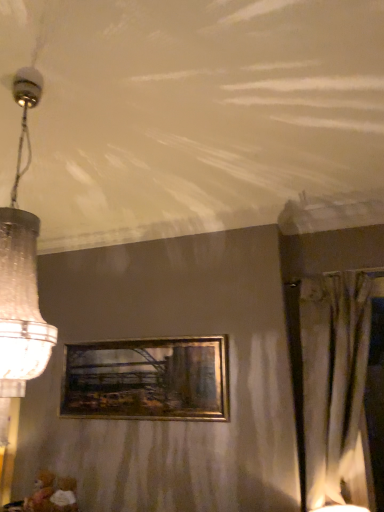
Question: From a real-world perspective, is clear glass chandelier at left beneath silky beige curtain at right?

Choices:
 (A) yes
 (B) no

Answer: (B)

Question: Is clear glass chandelier at left surrounding silky beige curtain at right?

Choices:
 (A) yes
 (B) no

Answer: (B)

Question: Does clear glass chandelier at left have a greater height compared to silky beige curtain at right?

Choices:
 (A) no
 (B) yes

Answer: (A)

Question: Does clear glass chandelier at left have a greater width compared to silky beige curtain at right?

Choices:
 (A) yes
 (B) no

Answer: (A)

Question: Is clear glass chandelier at left facing towards silky beige curtain at right?

Choices:
 (A) no
 (B) yes

Answer: (A)

Question: In terms of width, does clear glass chandelier at left look wider or thinner when compared to gold metallic picture frame at center?

Choices:
 (A) wide
 (B) thin

Answer: (A)

Question: Is clear glass chandelier at left bigger or smaller than gold metallic picture frame at center?

Choices:
 (A) big
 (B) small

Answer: (A)

Question: Is point (39, 324) closer or farther from the camera than point (208, 340)?

Choices:
 (A) farther
 (B) closer

Answer: (B)

Question: From a real-world perspective, relative to gold metallic picture frame at center, is clear glass chandelier at left vertically above or below?

Choices:
 (A) below
 (B) above

Answer: (B)

Question: From a real-world perspective, relative to gold metallic picture frame at center, is silky beige curtain at right vertically above or below?

Choices:
 (A) above
 (B) below

Answer: (B)

Question: In terms of size, does silky beige curtain at right appear bigger or smaller than gold metallic picture frame at center?

Choices:
 (A) small
 (B) big

Answer: (B)

Question: From the image's perspective, relative to gold metallic picture frame at center, is silky beige curtain at right above or below?

Choices:
 (A) above
 (B) below

Answer: (A)

Question: Is silky beige curtain at right in front of or behind gold metallic picture frame at center in the image?

Choices:
 (A) front
 (B) behind

Answer: (A)

Question: From the image's perspective, is silky beige curtain at right located above or below clear glass chandelier at left?

Choices:
 (A) below
 (B) above

Answer: (A)

Question: Relative to clear glass chandelier at left, is silky beige curtain at right in front or behind?

Choices:
 (A) front
 (B) behind

Answer: (B)